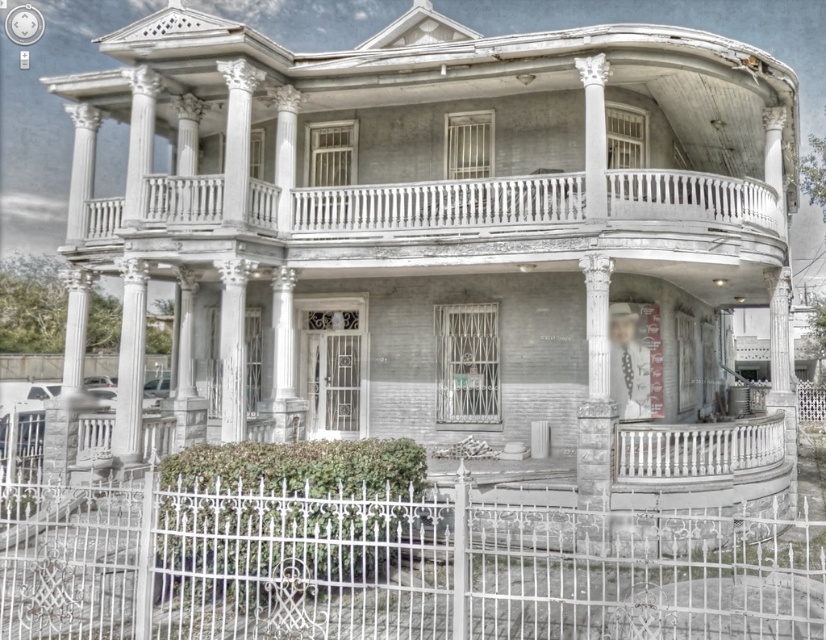
You are standing at the entrance of the house and want to walk towards the white wrought iron fence at lower center. What are the coordinates of the direction you should walk towards?

The white wrought iron fence at lower center is located at coordinates point (392, 566), so you should walk towards that point.

You are a delivery person approaching the house and need to determine the shortest path to the front door. You see the white wrought iron fence at lower center and the white wood balustrade at lower right. Which object is shorter and can be easily stepped over to access the front door?

The white wrought iron fence at lower center is shorter than the white wood balustrade at lower right, so it can be easily stepped over to access the front door.

You are a delivery person standing at the entrance of the property. You need to leave a package at the doorstep of the house. The white wrought iron fence at lower center is in your way. Can you walk around it to reach the front door? Please explain your reasoning.

The white wrought iron fence at lower center is 22.59 feet away from you. Since fences typically have gates or pathways around them, you can likely walk around it to reach the front door. However, the exact path depends on the fence layout not described here.